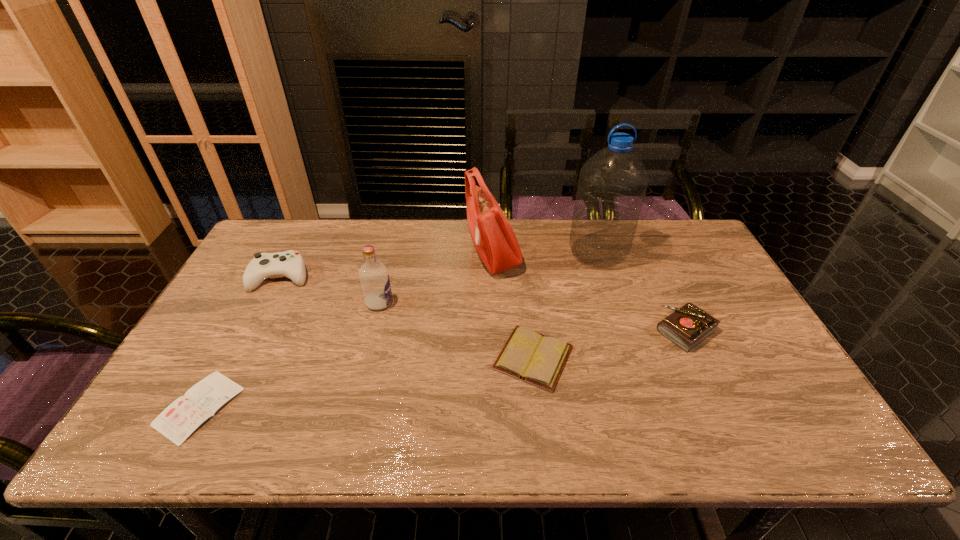
Find the location of `the shortest diary`. the shortest diary is located at coordinates (181, 418).

Where is `free space located on the right of the tallest object`? The width and height of the screenshot is (960, 540). free space located on the right of the tallest object is located at coordinates pos(676,253).

Identify the location of vacant area situated on the front-facing side of the second tallest object. (372, 256).

Identify the location of free spot located 0.340m on the front-facing side of the second tallest object. (363, 256).

Find the location of a particular element. This screenshot has width=960, height=540. free location located on the front-facing side of the second tallest object is located at coordinates (357, 256).

At what (x,y) coordinates should I click in order to perform the action: click on blank space located on the label of the third tallest object. Please return your answer as a coordinate pair (x, y). The height and width of the screenshot is (540, 960). Looking at the image, I should click on (423, 302).

Identify the location of free space located 0.130m on the right of the control. The height and width of the screenshot is (540, 960). coord(351,277).

Image resolution: width=960 pixels, height=540 pixels. I want to click on vacant space located on the back of the third shortest object, so click(659, 272).

Locate an element on the screen. The width and height of the screenshot is (960, 540). free region located on the front of the second diary from right to left is located at coordinates (541, 431).

Identify the location of vacant space located 0.090m on the back of the shortest object. The width and height of the screenshot is (960, 540). (233, 344).